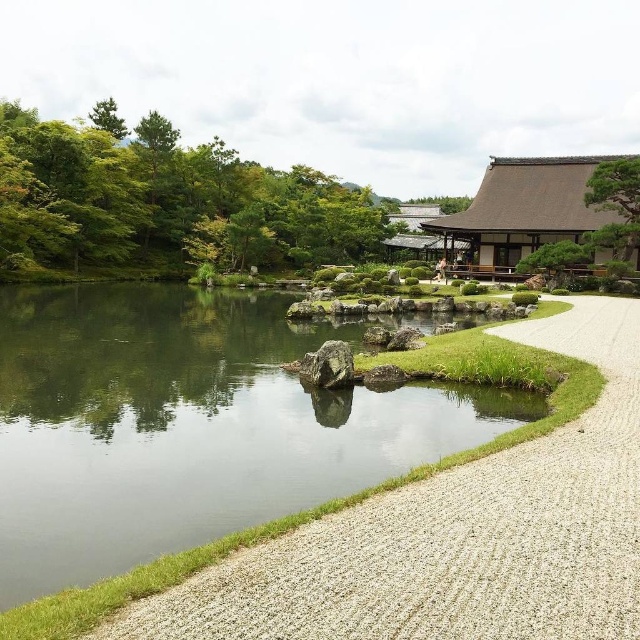
You are a visitor in the Japanese garden and want to take a photo of the gravel at lower right and the green textured tree at upper right. Which object is positioned to the left of the other?

The gravel at lower right is to the left of green textured tree at upper right.